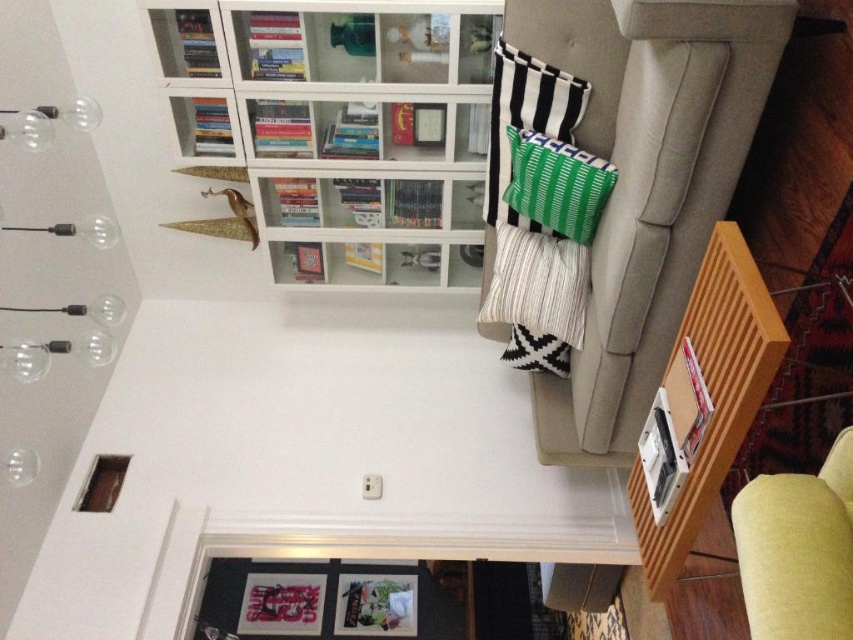
Question: Which object appears closest to the camera in this image?

Choices:
 (A) white glass bookshelf at upper left
 (B) light yellow fabric armchair at lower right
 (C) green striped pillow at upper right
 (D) beige fabric couch at right

Answer: (B)

Question: Can you confirm if light yellow fabric armchair at lower right is thinner than green striped pillow at upper right?

Choices:
 (A) no
 (B) yes

Answer: (A)

Question: Is white glass bookshelf at upper left positioned in front of light yellow fabric armchair at lower right?

Choices:
 (A) yes
 (B) no

Answer: (B)

Question: Which point is farther to the camera?

Choices:
 (A) (564, 387)
 (B) (757, 621)

Answer: (A)

Question: Which point is closer to the camera?

Choices:
 (A) green striped pillow at upper right
 (B) white glass bookshelf at upper left
 (C) light yellow fabric armchair at lower right

Answer: (C)

Question: Does white glass bookshelf at upper left come behind light yellow fabric armchair at lower right?

Choices:
 (A) yes
 (B) no

Answer: (A)